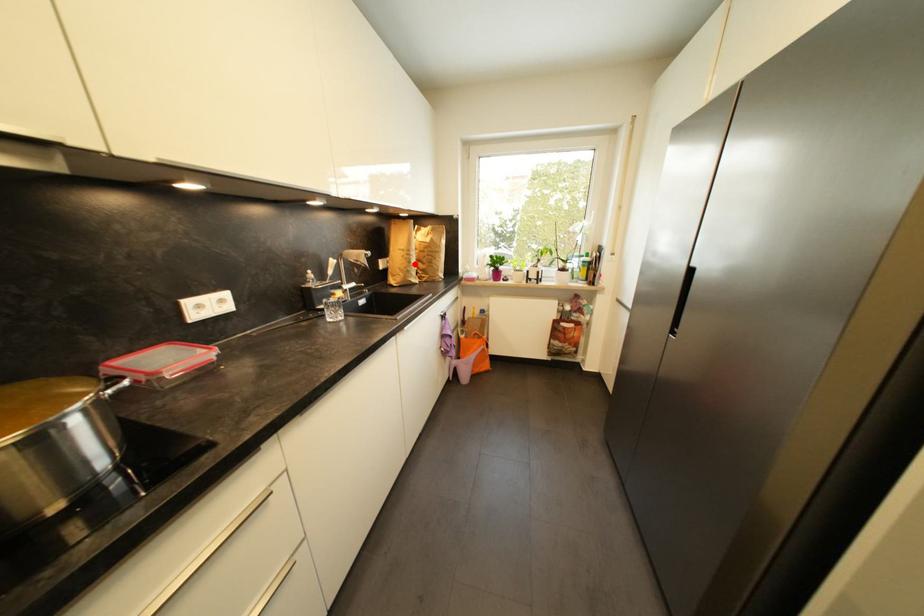
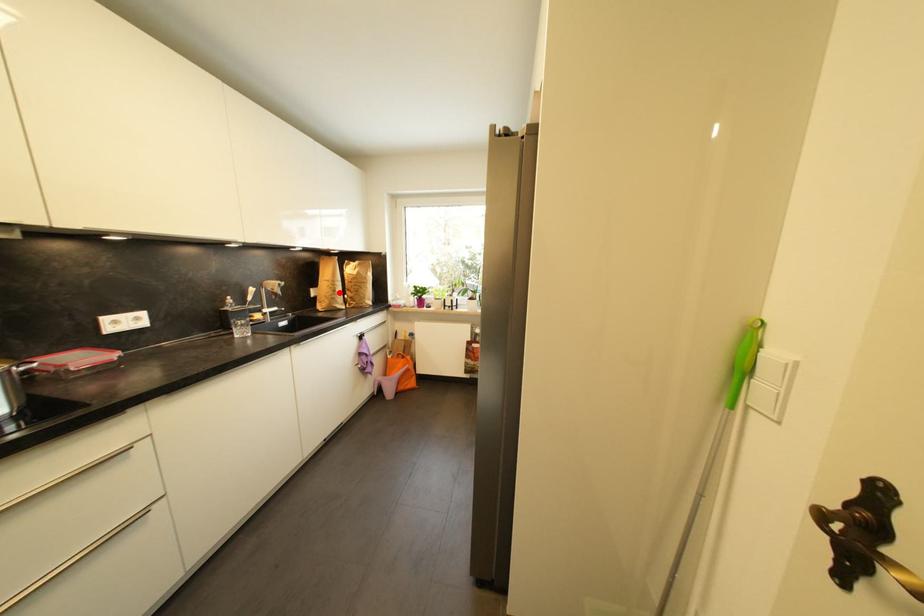
I am providing you with two images of the same scene from different viewpoints. A red point is marked on the first image and another point is marked on the second image. Is the red point in image1 aligned with the point shown in image2?

Yes